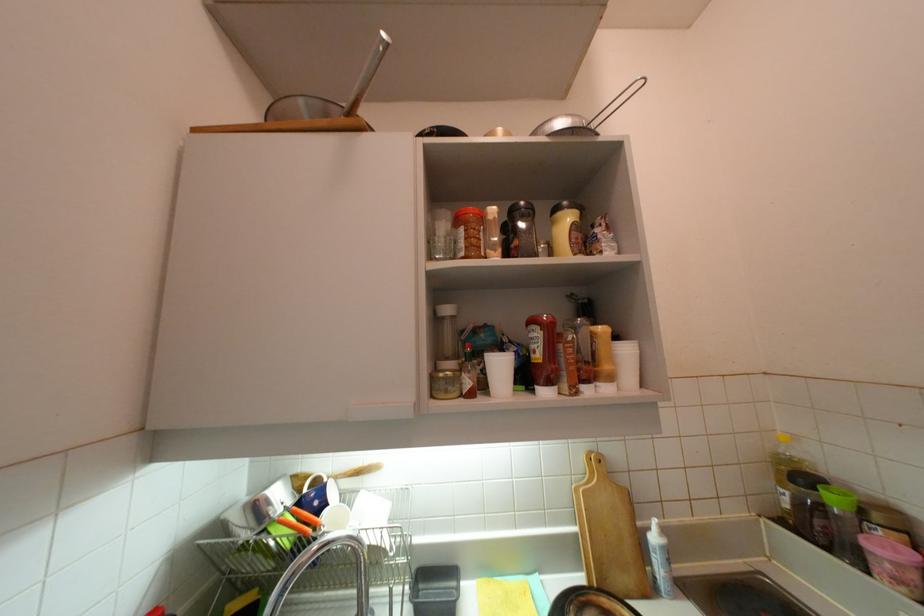
Image resolution: width=924 pixels, height=616 pixels. Find the location of `green lidded jar`. green lidded jar is located at coordinates (844, 525).